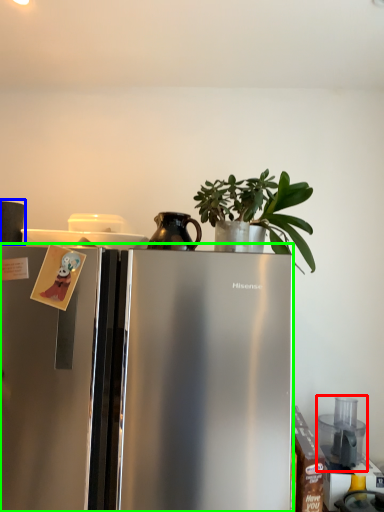
Question: Which is nearer to the appliance (highlighted by a red box)? appliance (highlighted by a blue box) or refrigerator (highlighted by a green box).

Choices:
 (A) appliance
 (B) refrigerator

Answer: (B)